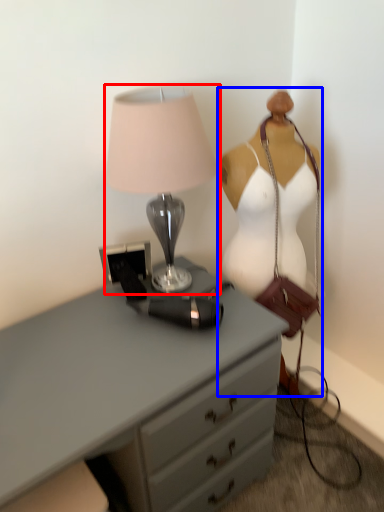
Question: Which object appears farthest to the camera in this image, lamp (highlighted by a red box) or mannequin (highlighted by a blue box)?

Choices:
 (A) lamp
 (B) mannequin

Answer: (B)